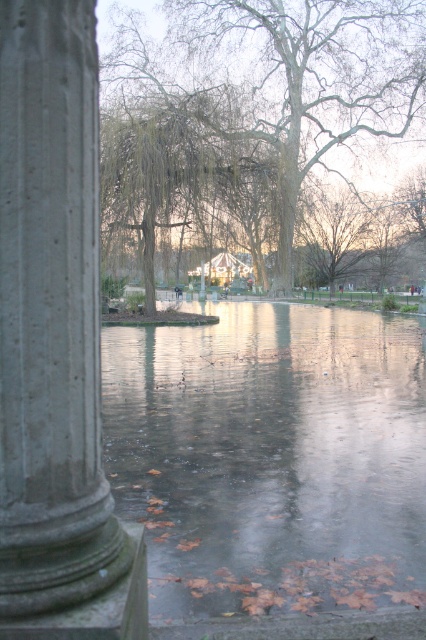
You are a park visitor who wants to walk across the translucent ice at center. You see the gray stone column at left nearby. Based on their positions, can you tell if the ice is under the column or below it?

The translucent ice at center is below gray stone column at left, so the ice is positioned under the column.

You are standing in the park and want to walk to both points. Which point, point [301,611] or point [290,156], will you reach first?

Point [301,611] is closer to the viewer than point [290,156], so you will reach point [301,611] first.

You are standing in the park and want to take a photo of the smooth bark tree at center. The gray stone column at left is blocking your view. Can you move to the right to get a clear shot?

The gray stone column at left is closer to the viewer than the smooth bark tree at center, so moving to the right may allow you to position yourself around the column and get a clear view of the smooth bark tree at center.